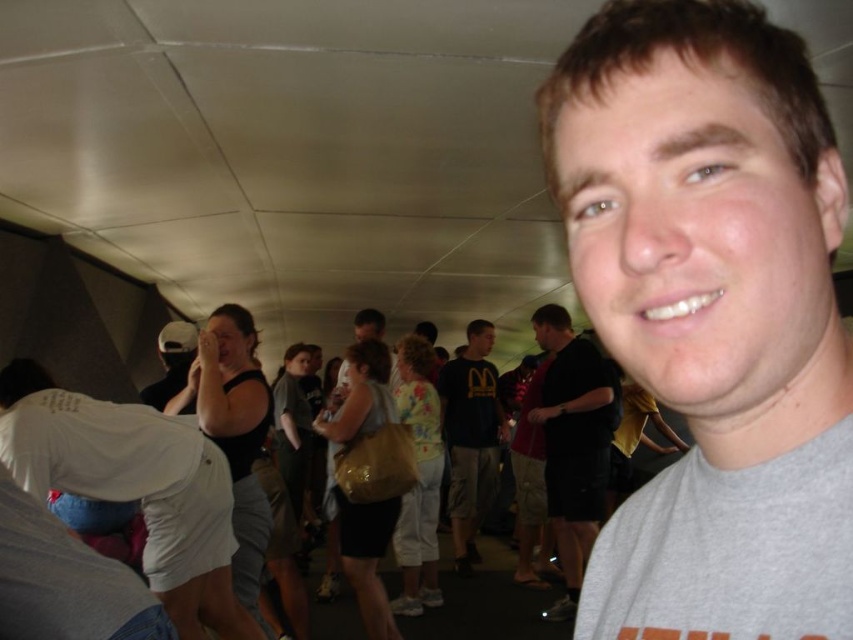
Does white matte shirt at lower left have a lesser width compared to dark blue t-shirt at center?

No.

Can you confirm if white matte shirt at lower left is smaller than dark blue t-shirt at center?

Indeed, white matte shirt at lower left has a smaller size compared to dark blue t-shirt at center.

You are a GUI agent. You are given a task and a screenshot of the screen. Output one action in this format:
    pyautogui.click(x=<x>, y=<y>)
    Task: Click on the white matte shirt at lower left
    The image size is (853, 640).
    Given the screenshot: What is the action you would take?
    pyautogui.click(x=134, y=486)

Between white matte shirt at lower left and dark gray t-shirt at center, which one appears on the right side from the viewer's perspective?

dark gray t-shirt at center is more to the right.

Who is shorter, white matte shirt at lower left or dark gray t-shirt at center?

white matte shirt at lower left

This screenshot has width=853, height=640. What are the coordinates of `white matte shirt at lower left` in the screenshot? It's located at (134, 486).

Does point (782, 541) lie behind point (613, 401)?

No, it is not.

Which is more to the left, gray matte t-shirt at center or dark gray t-shirt at center?

Positioned to the left is gray matte t-shirt at center.

Does point (729, 304) come closer to viewer compared to point (576, 602)?

That is True.

Find the location of a particular element. The height and width of the screenshot is (640, 853). gray matte t-shirt at center is located at coordinates (712, 314).